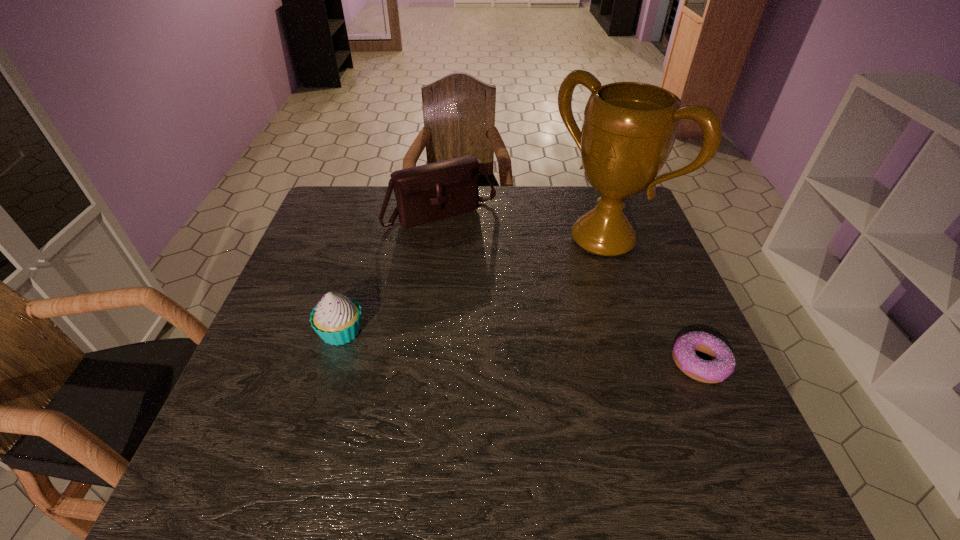
Identify the location of vacant space on the desktop that is between the second shortest object and the doughnut and is positioned on the front flap of the shoulder bag. (540, 349).

Image resolution: width=960 pixels, height=540 pixels. In order to click on free space on the desktop that is between the cupcake and the shortest object and is positioned on the front of the tallest object with the decoration in this screenshot , I will do [464, 342].